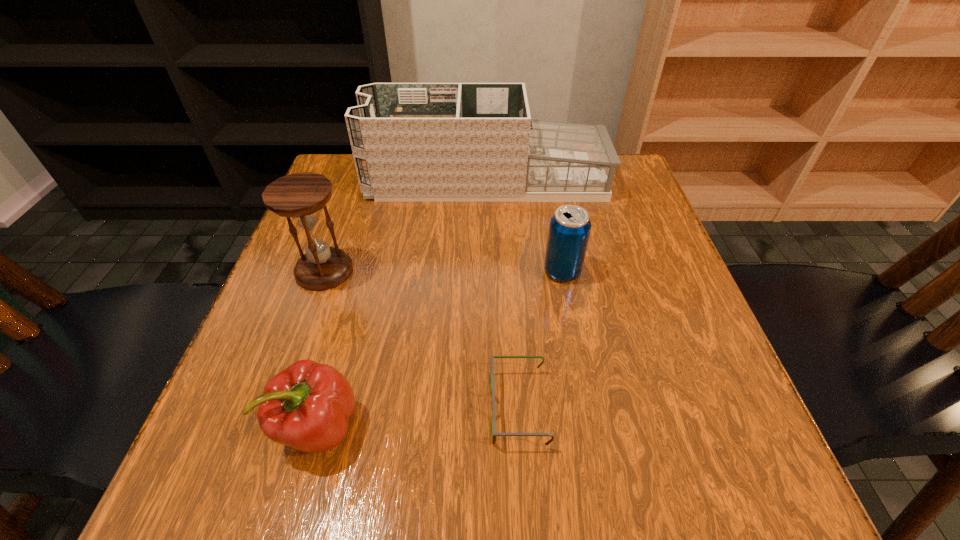
Find the location of a particular element. vacant region that satisfies the following two spatial constraints: 1. at the entrance of the farthest object; 2. on the right side of the pop soda is located at coordinates (488, 271).

Locate an element on the screen. This screenshot has height=540, width=960. vacant position in the image that satisfies the following two spatial constraints: 1. at the entrance of the pop soda; 2. on the right side of the dollhouse is located at coordinates (488, 271).

Where is `free spot that satisfies the following two spatial constraints: 1. on the front side of the second shortest object; 2. on the left side of the hourglass`? Image resolution: width=960 pixels, height=540 pixels. free spot that satisfies the following two spatial constraints: 1. on the front side of the second shortest object; 2. on the left side of the hourglass is located at coordinates (269, 427).